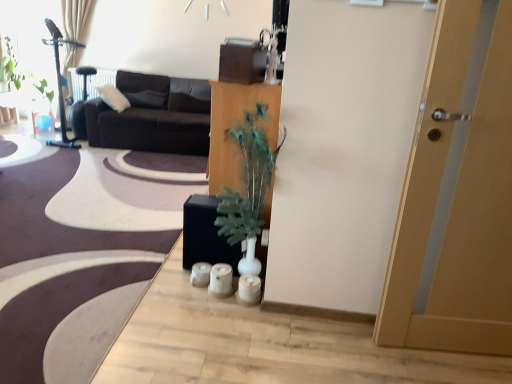
You are a GUI agent. You are given a task and a screenshot of the screen. Output one action in this format:
    pyautogui.click(x=<x>, y=<y>)
    Task: Click on the blank space situated above black matte speaker at lower left (from a real-world perspective)
    
    Given the screenshot: What is the action you would take?
    pyautogui.click(x=82, y=205)